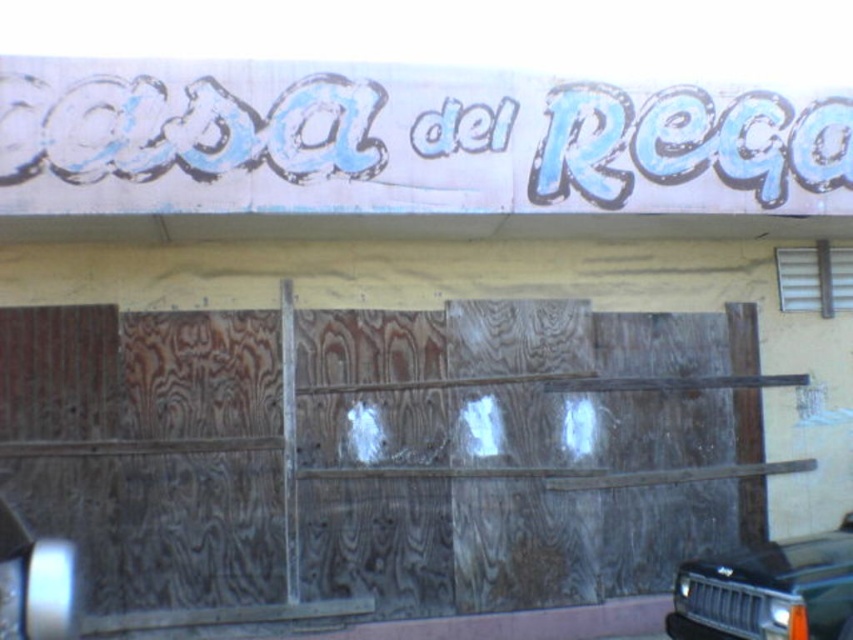
You are a delivery person trying to park your black matte car at lower right near the weathered wood garage door at center. Can your car fit next to the garage door without overlapping it?

The weathered wood garage door at center is larger in size than the black matte car at lower right, so there should be enough space for the car to park next to it without overlapping.

You are a painter who needs to cover the weathered wood garage door at center and the blue painted sign at upper center with a protective coating. Which object requires a larger amount of coating material?

The weathered wood garage door at center requires a larger amount of coating material because it is bigger than the blue painted sign at upper center.

You are a painter who needs to know if the weathered wood garage door at center can be painted without covering the blue painted sign at upper center. Can you paint the door without affecting the sign?

The weathered wood garage door at center is much taller than the blue painted sign at upper center. Since the door is taller, painting it would require working below the sign, so the sign would remain unaffected.